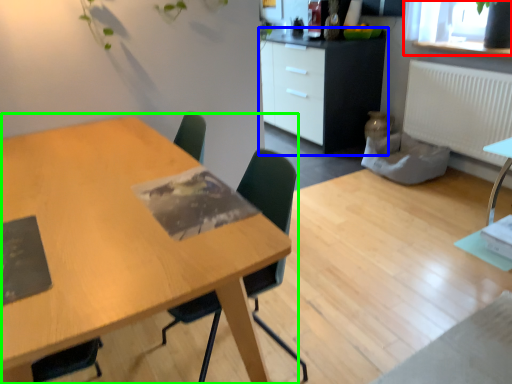
Question: Which object is the closest to the window screen (highlighted by a red box)? Choose among these: cabinetry (highlighted by a blue box) or table (highlighted by a green box).

Choices:
 (A) cabinetry
 (B) table

Answer: (A)